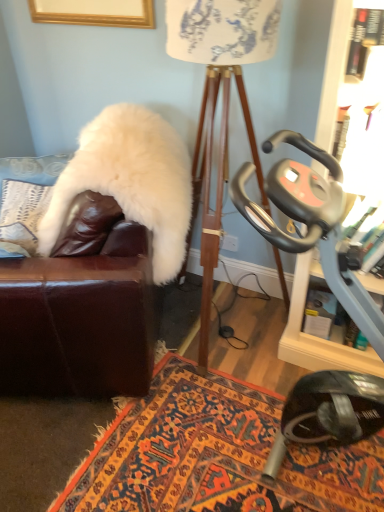
Question: Considering the positions of white fluffy pillow at upper left and white fabric lampshade at center in the image, is white fluffy pillow at upper left wider or thinner than white fabric lampshade at center?

Choices:
 (A) wide
 (B) thin

Answer: (B)

Question: In the image, is white fluffy pillow at upper left positioned in front of or behind white fabric lampshade at center?

Choices:
 (A) front
 (B) behind

Answer: (B)

Question: Which object is positioned closest to the metallic gray stationary bike at right?

Choices:
 (A) white fluffy pillow at upper left
 (B) white fabric lampshade at center
 (C) carpeted rug at center
 (D) white fluffy fur coat at left

Answer: (C)

Question: Which of these objects is positioned farthest from the white fabric lampshade at center?

Choices:
 (A) white fluffy fur coat at left
 (B) carpeted rug at center
 (C) metallic gray stationary bike at right
 (D) white fluffy pillow at upper left

Answer: (D)